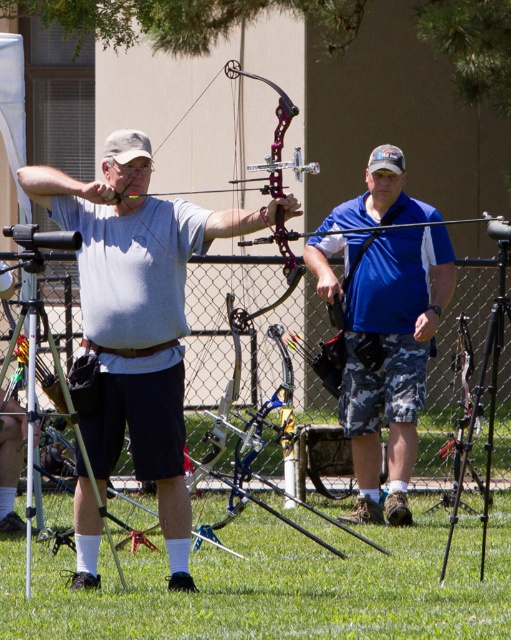
Question: Does matte gray shirt at center have a greater width compared to blue/camo shorts at center?

Choices:
 (A) yes
 (B) no

Answer: (A)

Question: Which of the following is the farthest from the observer?

Choices:
 (A) (388, 410)
 (B) (78, 580)

Answer: (A)

Question: Is matte gray shirt at center below blue/camo shorts at center?

Choices:
 (A) no
 (B) yes

Answer: (B)

Question: Is matte gray shirt at center thinner than blue/camo shorts at center?

Choices:
 (A) no
 (B) yes

Answer: (A)